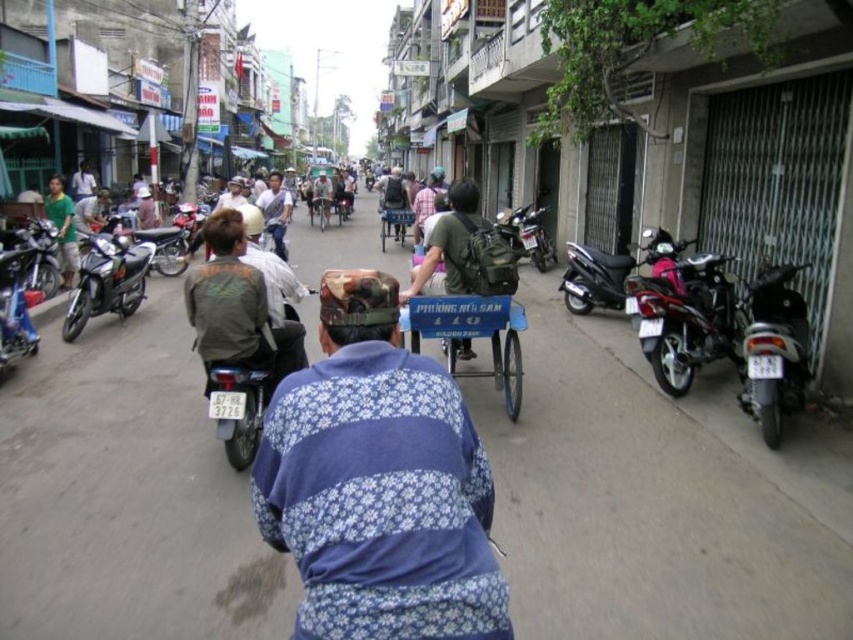
You are a delivery person who needs to pass through the street between the blue painted wood cart at center and the light blue shirt at center. Can you fit through the space between them?

The blue painted wood cart at center is thinner than the light blue shirt at center, so the space between them may be narrow. However, since the cart is thinner, the total width available between them might still allow passage, but it depends on the delivery person and vehicle size.

In the scene shown: You are a pedestrian standing on the street and want to cross to the other side. There are two people in front of you wearing a blue floral sweater at center and a light blue shirt at center. Which person should you wait for to move first before proceeding?

You should wait for the blue floral sweater at center to move first because they are closer to you than the light blue shirt at center. Once they move, you can proceed as the other person is further away and might not block your path.

What are the coordinates of the blue floral sweater at center in the image?

The blue floral sweater at center is located at coordinates (378, 483).